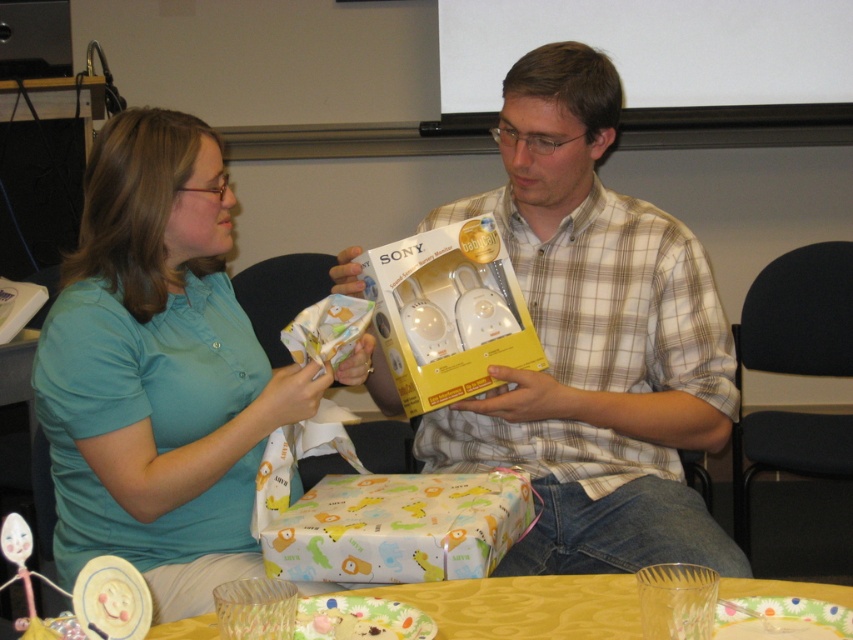
You are organizing a baby shower and need to arrange the plaid shirt at center and the printed paper gift at center on a table. The table is 30 centimeters wide. Can both items fit side by side without overlapping?

The plaid shirt at center and the printed paper gift at center are 24.25 centimeters apart from each other. Since the table is 30 centimeters wide, there is enough space to place them side by side without overlapping.

In the image, there are a plaid shirt at center and a printed paper gift at center. From the perspective of someone standing in front of the scene, which object is positioned to the right?

The plaid shirt at center is to the right of the printed paper gift at center.